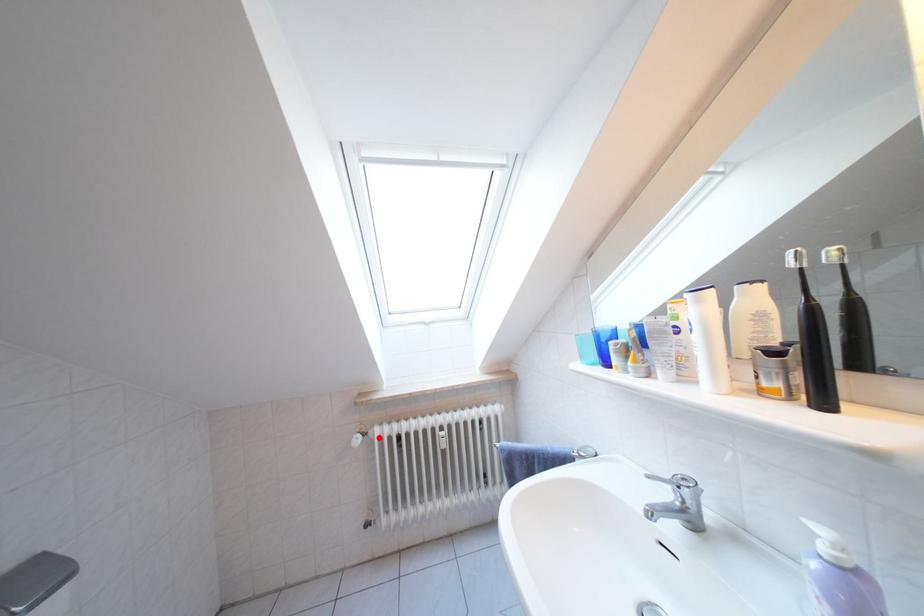
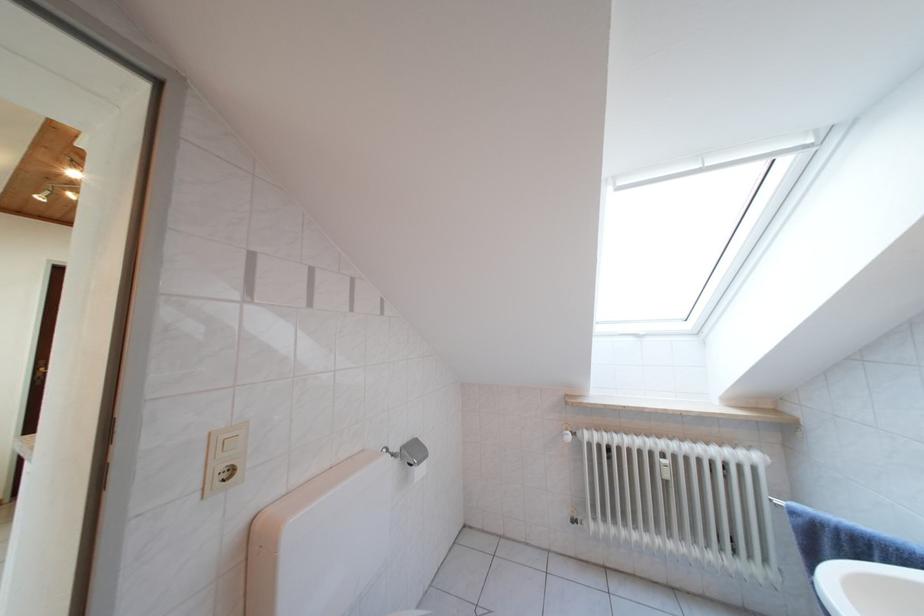
Question: I am providing you with two images of the same scene from different viewpoints. Given a red point in image1, look at the same physical point in image2. Is it:

Choices:
 (A) Closer to the viewpoint
 (B) Farther from the viewpoint

Answer: (B)